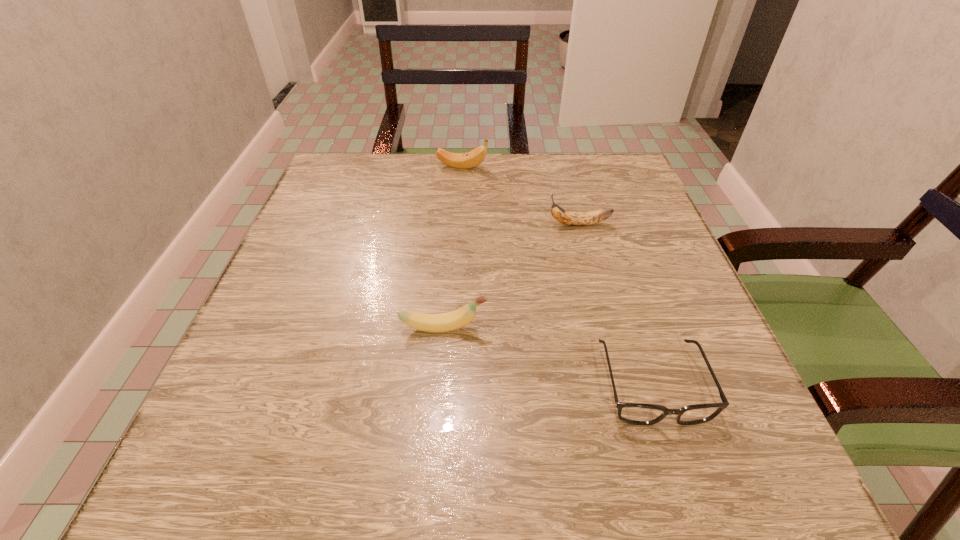
This screenshot has height=540, width=960. I want to click on the farthest banana, so click(x=473, y=158).

At what (x,y) coordinates should I click in order to perform the action: click on the rightmost banana. Please return your answer as a coordinate pair (x, y). Looking at the image, I should click on (563, 216).

Where is `the second farthest object`? The image size is (960, 540). the second farthest object is located at coordinates (563, 216).

Locate an element on the screen. This screenshot has width=960, height=540. the nearest banana is located at coordinates (443, 322).

Identify the location of the nearest object. The image size is (960, 540). (632, 413).

Find the location of a particular element. Image resolution: width=960 pixels, height=540 pixels. spectacles is located at coordinates (632, 413).

Image resolution: width=960 pixels, height=540 pixels. In order to click on vacant space located on the left of the farthest object in this screenshot , I will do `click(350, 167)`.

This screenshot has height=540, width=960. I want to click on free space located on the peel of the rightmost banana, so pos(404,225).

Find the location of a particular element. The width and height of the screenshot is (960, 540). blank space located 0.290m on the peel of the rightmost banana is located at coordinates (413, 225).

The image size is (960, 540). What are the coordinates of `free space located on the peel of the rightmost banana` in the screenshot? It's located at (385, 225).